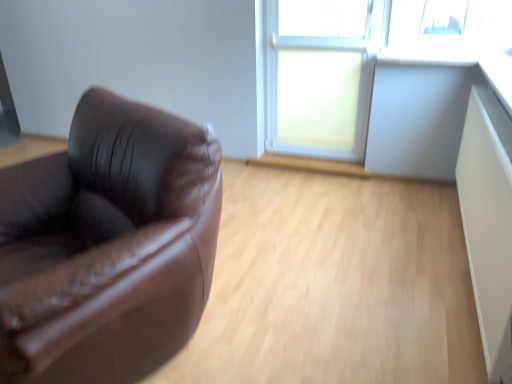
Question: Does point (289, 57) appear closer or farther from the camera than point (354, 72)?

Choices:
 (A) farther
 (B) closer

Answer: (A)

Question: Relative to white plastic window frame at upper right, is matte glass window at center in front or behind?

Choices:
 (A) behind
 (B) front

Answer: (A)

Question: In terms of size, does matte glass window at center appear bigger or smaller than white plastic window frame at upper right?

Choices:
 (A) big
 (B) small

Answer: (B)

Question: Would you say white plastic window frame at upper right is to the left or to the right of matte glass window at center in the picture?

Choices:
 (A) left
 (B) right

Answer: (B)

Question: Is point (287, 117) closer or farther from the camera than point (316, 120)?

Choices:
 (A) farther
 (B) closer

Answer: (A)

Question: From a real-world perspective, is white plastic window frame at upper right above or below matte glass window at center?

Choices:
 (A) above
 (B) below

Answer: (A)

Question: Considering their positions, is white plastic window frame at upper right located in front of or behind matte glass window at center?

Choices:
 (A) front
 (B) behind

Answer: (A)